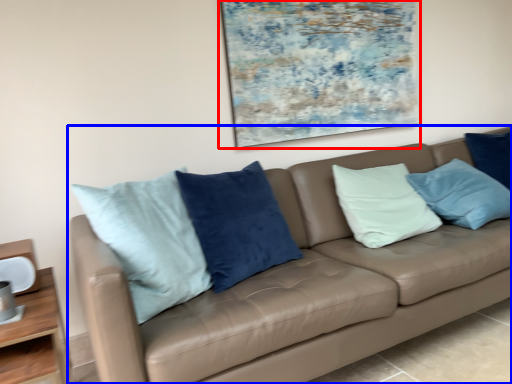
Question: Which of the following is the closest to the observer, picture frame (highlighted by a red box) or studio couch (highlighted by a blue box)?

Choices:
 (A) picture frame
 (B) studio couch

Answer: (B)